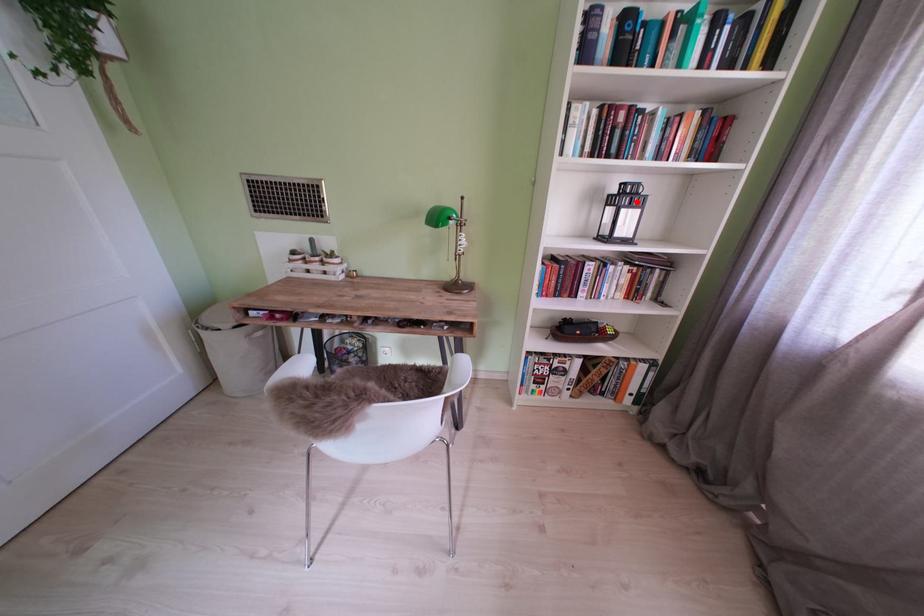
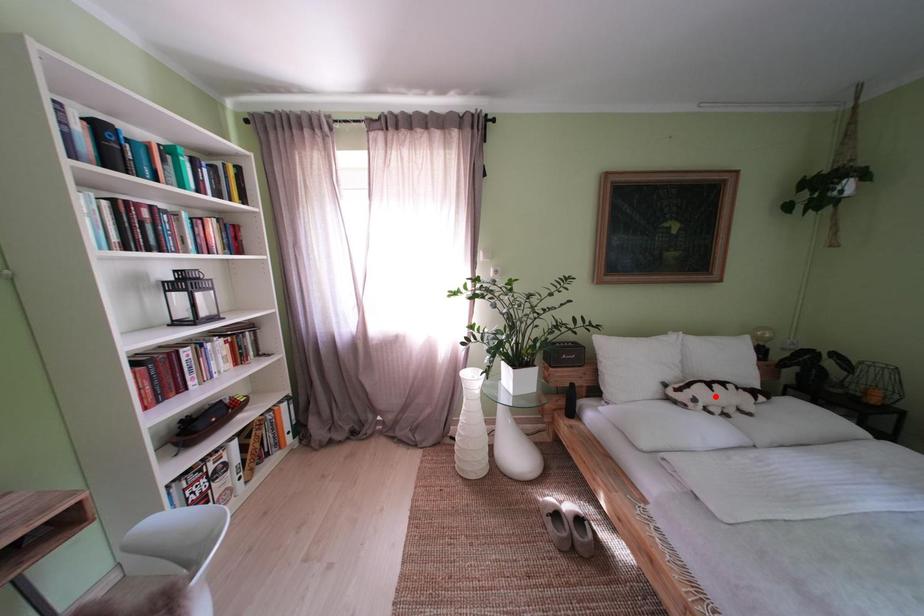
I am providing you with two images of the same scene from different viewpoints. A red point is marked on the first image and another point is marked on the second image. Is the red point in image1 aligned with the point shown in image2?

No